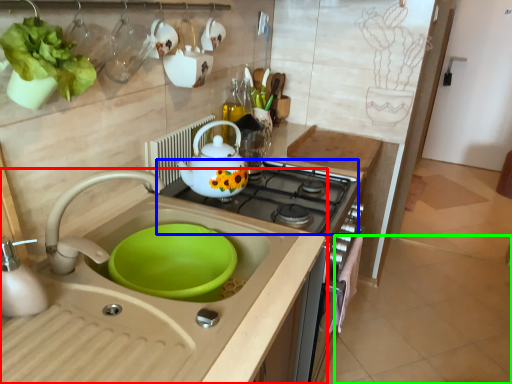
Question: Estimate the real-world distances between objects in this image. Which object is closer to sink (highlighted by a red box), gas stove (highlighted by a blue box) or tile (highlighted by a green box)?

Choices:
 (A) gas stove
 (B) tile

Answer: (A)